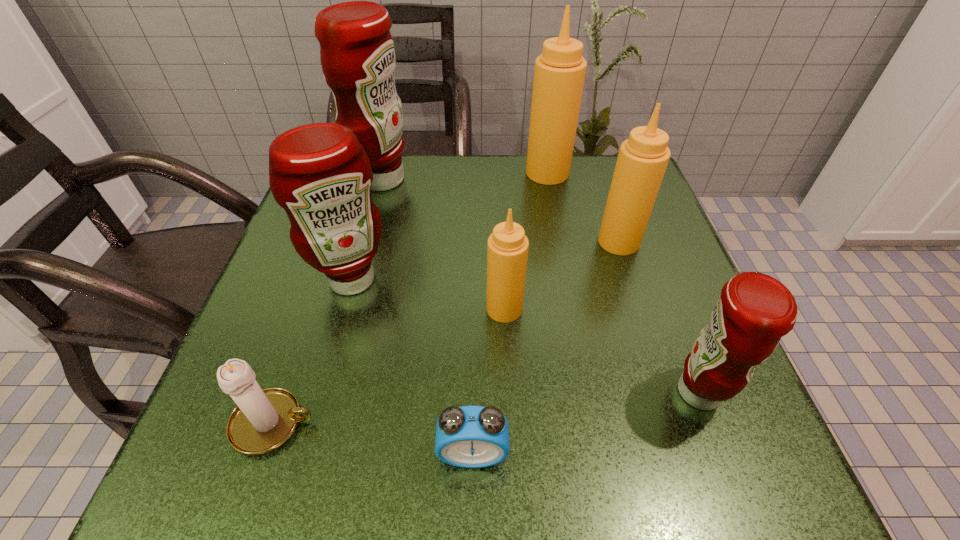
Where is `condiment at the near edge`? The image size is (960, 540). condiment at the near edge is located at coordinates click(x=755, y=310).

I want to click on candle holder that is at the near edge, so click(263, 420).

At what (x,y) coordinates should I click in order to perform the action: click on alarm clock that is at the near edge. Please return your answer as a coordinate pair (x, y). This screenshot has height=540, width=960. Looking at the image, I should click on (468, 436).

What are the coordinates of `candle holder at the left edge` in the screenshot? It's located at click(x=263, y=420).

Where is `object positioned at the far left corner`? object positioned at the far left corner is located at coordinates (357, 53).

At what (x,y) coordinates should I click in order to perform the action: click on object present at the near left corner. Please return your answer as a coordinate pair (x, y). This screenshot has height=540, width=960. Looking at the image, I should click on (263, 420).

Identify the location of object at the near right corner. The image size is (960, 540). (755, 310).

Image resolution: width=960 pixels, height=540 pixels. Identify the location of vacant space at the far edge of the desktop. (510, 185).

You are a GUI agent. You are given a task and a screenshot of the screen. Output one action in this format:
    pyautogui.click(x=<x>, y=<y>)
    Task: Click on the free location at the near edge
    This screenshot has height=540, width=960.
    Given the screenshot: What is the action you would take?
    pyautogui.click(x=585, y=487)

You are a GUI agent. You are given a task and a screenshot of the screen. Output one action in this format:
    pyautogui.click(x=<x>, y=<y>)
    Task: Click on the free location at the left edge
    The width and height of the screenshot is (960, 540).
    Given the screenshot: What is the action you would take?
    pyautogui.click(x=324, y=277)